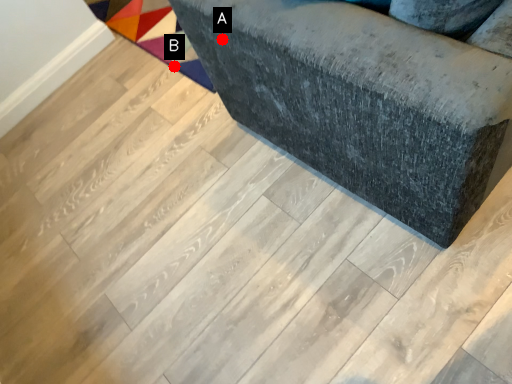
Question: Two points are circled on the image, labeled by A and B beside each circle. Which point is closer to the camera?

Choices:
 (A) A is closer
 (B) B is closer

Answer: (A)